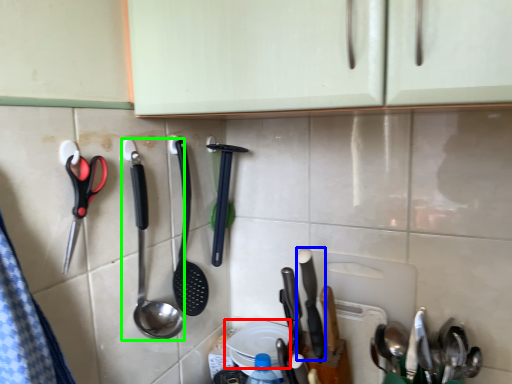
Question: Estimate the real-world distances between objects in this image. Which object is closer to plate (highlighted by a red box), silverware (highlighted by a blue box) or spoon (highlighted by a green box)?

Choices:
 (A) silverware
 (B) spoon

Answer: (A)